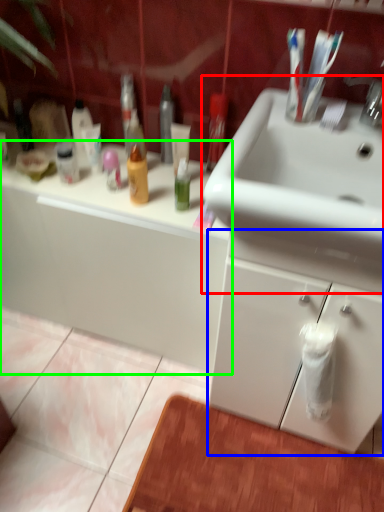
Question: Which object is positioned farthest from sink (highlighted by a red box)? Select from bathroom cabinet (highlighted by a blue box) and bathroom cabinet (highlighted by a green box).

Choices:
 (A) bathroom cabinet
 (B) bathroom cabinet

Answer: (B)